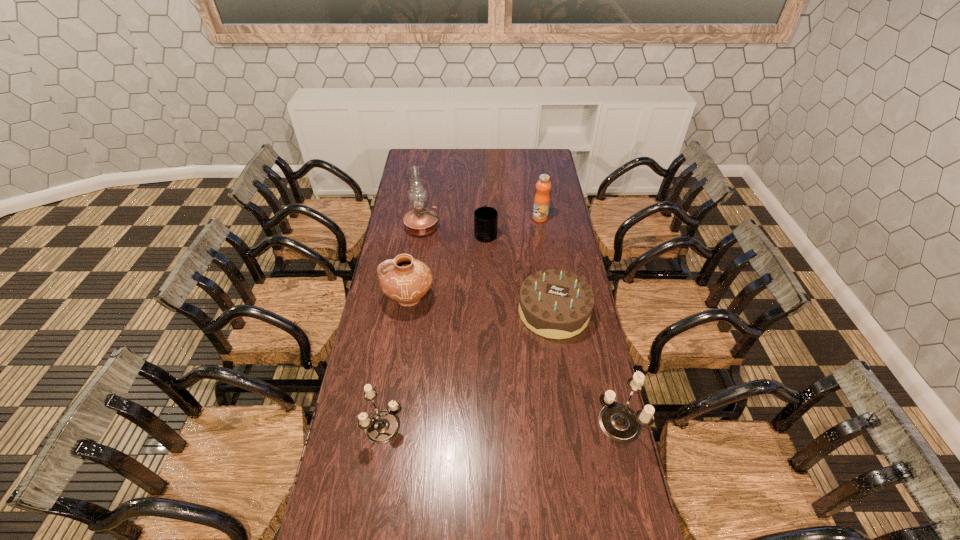
Please determine a free point for an extra candle_holder to ensure balance. Please provide its 2D coordinates. Your answer should be formatted as a tuple, i.e. [(x, y)], where the tuple contains the x and y coordinates of a point satisfying the conditions above.

[(501, 424)]